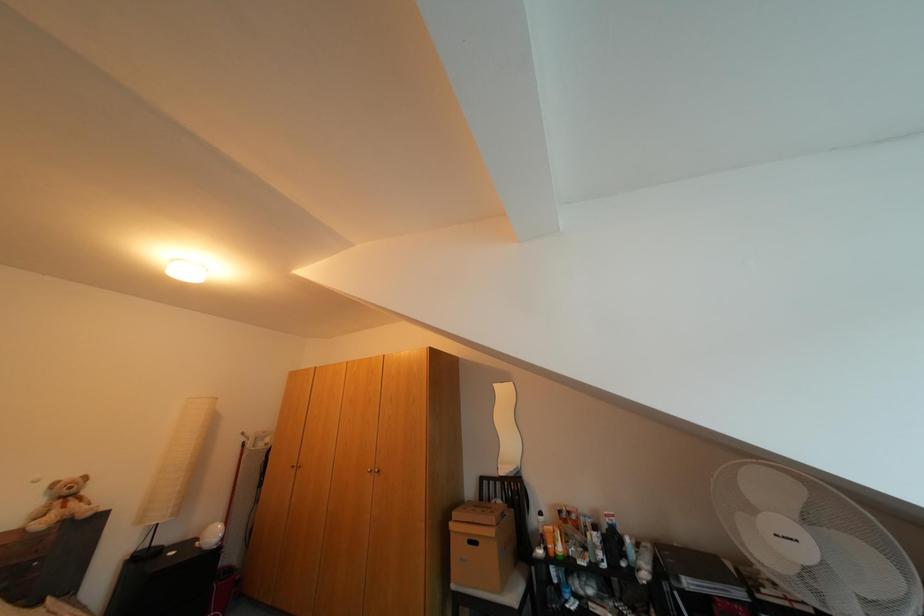
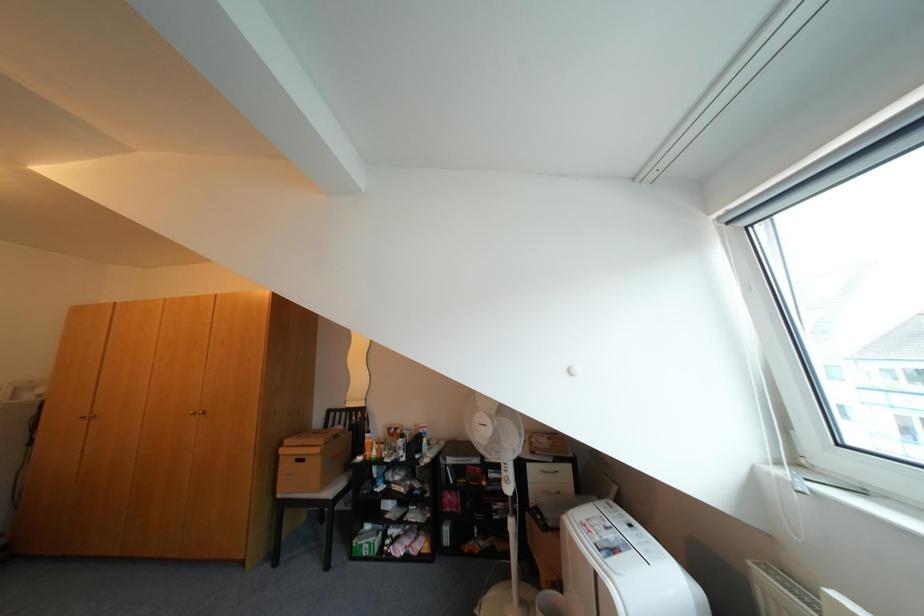
What movement of the cameraman would produce the second image?

The movement direction of the cameraman is right, backward.